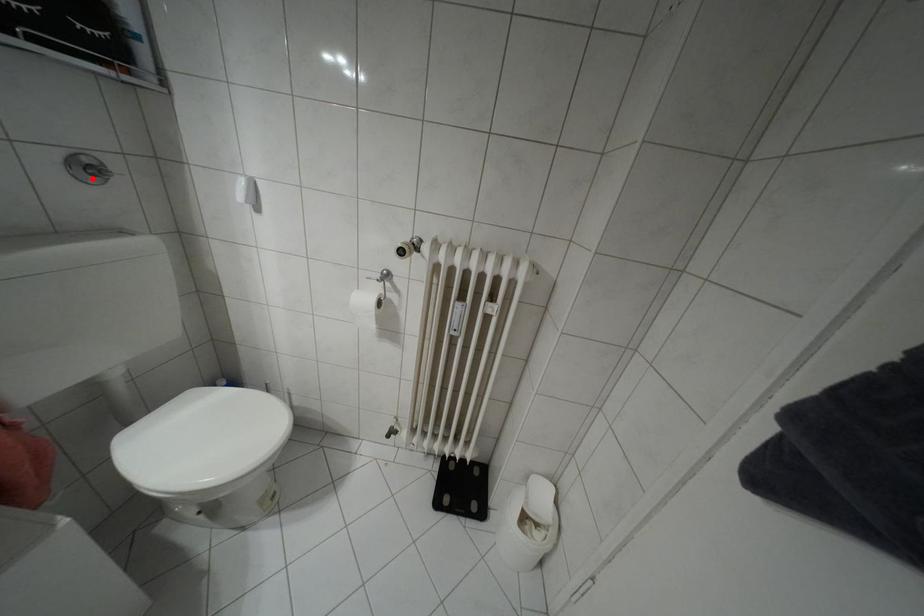
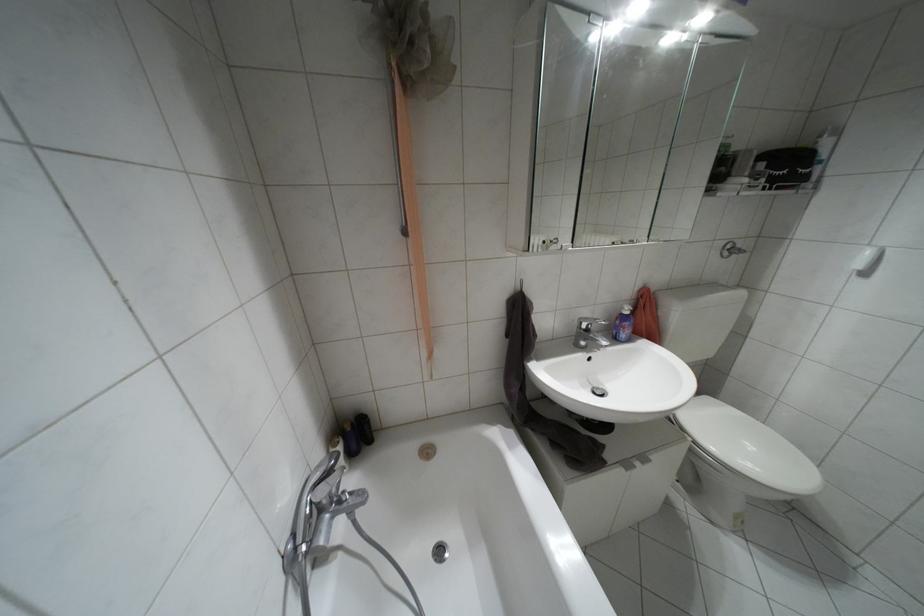
Find the pixel in the second image that matches the highlighted location in the first image.

(723, 254)